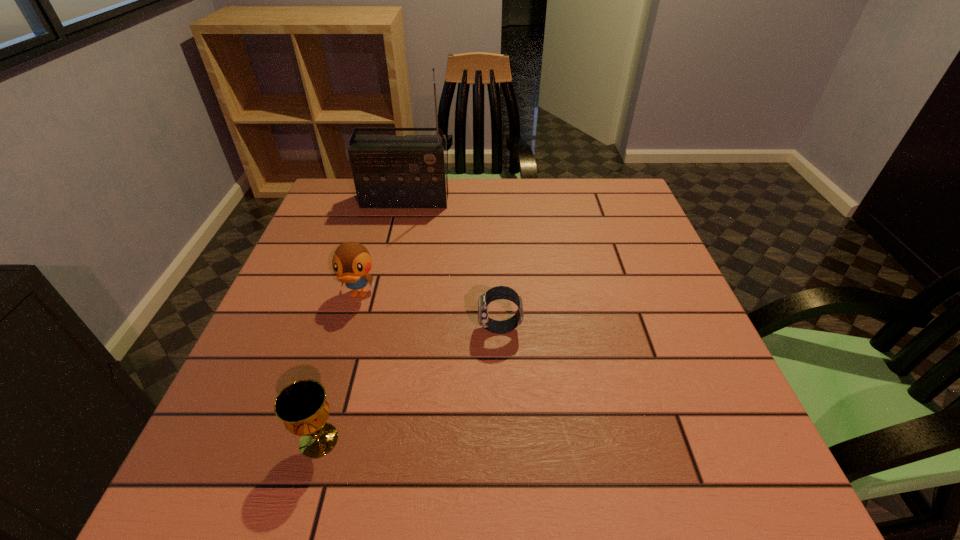
Identify the location of free space between the second farthest object and the nearest object. (339, 368).

The width and height of the screenshot is (960, 540). Identify the location of vacant region between the radio receiver and the second farthest object. (382, 247).

You are a GUI agent. You are given a task and a screenshot of the screen. Output one action in this format:
    pyautogui.click(x=<x>, y=<y>)
    Task: Click on the free space between the duck and the farthest object
    
    Given the screenshot: What is the action you would take?
    pyautogui.click(x=382, y=247)

The image size is (960, 540). I want to click on vacant region between the duck and the second nearest object, so click(x=429, y=312).

Find the location of a particular element. This screenshot has width=960, height=540. unoccupied position between the rightmost object and the duck is located at coordinates (429, 312).

At what (x,y) coordinates should I click in order to perform the action: click on object identified as the second closest to the third nearest object. Please return your answer as a coordinate pair (x, y). Looking at the image, I should click on (302, 406).

Where is `the third closest object to the nearest object`? Image resolution: width=960 pixels, height=540 pixels. the third closest object to the nearest object is located at coordinates (389, 171).

Image resolution: width=960 pixels, height=540 pixels. In order to click on free location that satisfies the following two spatial constraints: 1. on the front-facing side of the nearest object; 2. on the left side of the duck in this screenshot , I will do point(316,440).

This screenshot has height=540, width=960. What are the coordinates of `free space that satisfies the following two spatial constraints: 1. on the front-facing side of the third nearest object; 2. on the right side of the nearest object` in the screenshot? It's located at (316, 440).

Find the location of a particular element. vacant area in the image that satisfies the following two spatial constraints: 1. on the face of the watch; 2. on the front side of the chalice is located at coordinates (505, 440).